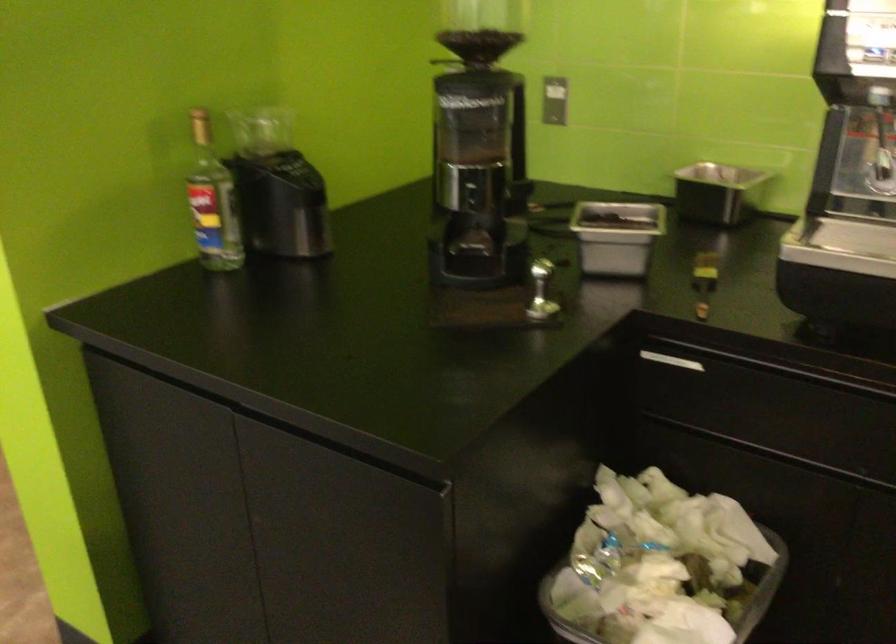
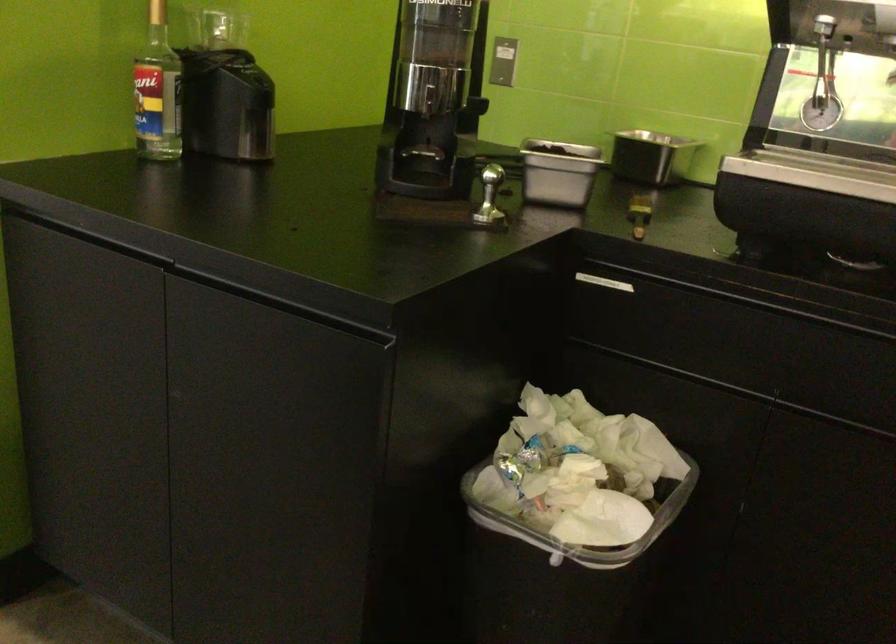
The point at (263, 127) is marked in the first image. Where is the corresponding point in the second image?

(216, 29)